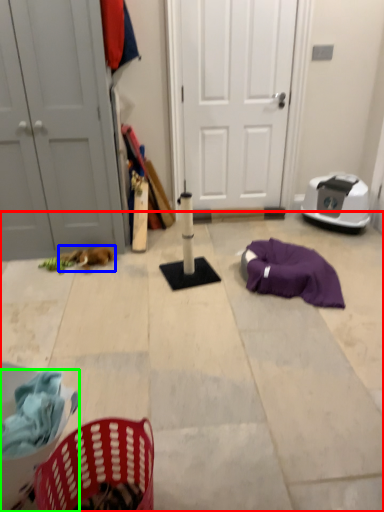
Question: Which is farther away from concrete (highlighted by a red box)? animal (highlighted by a blue box) or basket (highlighted by a green box)?

Choices:
 (A) animal
 (B) basket

Answer: (B)